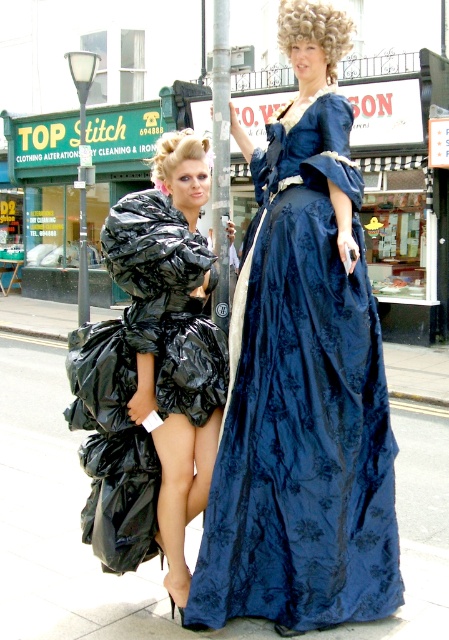
Is velvet blue gown at center above metallic silver pole at center?

No.

Which is behind, point (280, 627) or point (216, 316)?

The point (216, 316) is more distant.

Describe the element at coordinates (302, 406) in the screenshot. I see `velvet blue gown at center` at that location.

Find the location of a particular element. The height and width of the screenshot is (640, 449). velvet blue gown at center is located at coordinates (302, 406).

Does metallic silver pole at center appear on the left side of blonde synthetic wig at center?

Incorrect, metallic silver pole at center is not on the left side of blonde synthetic wig at center.

You are a GUI agent. You are given a task and a screenshot of the screen. Output one action in this format:
    pyautogui.click(x=<x>, y=<y>)
    Task: Click on the metallic silver pole at center
    This screenshot has width=449, height=640.
    Given the screenshot: What is the action you would take?
    pyautogui.click(x=220, y=157)

This screenshot has width=449, height=640. What are the coordinates of `metallic silver pole at center` in the screenshot? It's located at (220, 157).

Locate an element on the screen. This screenshot has height=640, width=449. metallic silver pole at center is located at coordinates (220, 157).

Who is taller, smooth concrete pavement at center or blonde curly wig at upper center?

blonde curly wig at upper center

This screenshot has width=449, height=640. In order to click on smooth concrete pavement at center in this screenshot , I will do `click(64, 522)`.

This screenshot has height=640, width=449. I want to click on smooth concrete pavement at center, so click(x=64, y=522).